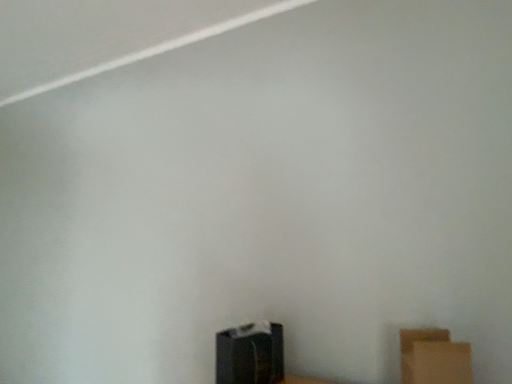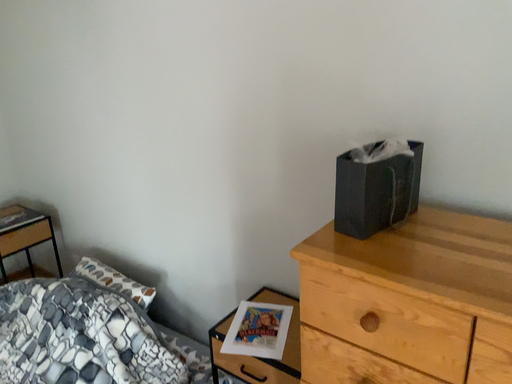
Question: Which way did the camera rotate in the video?

Choices:
 (A) rotated upward
 (B) rotated downward

Answer: (B)